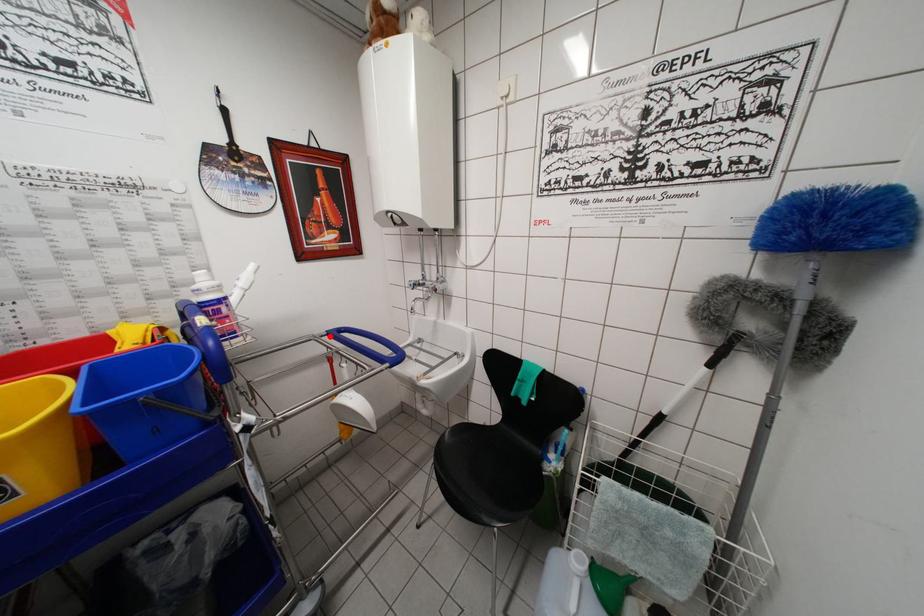
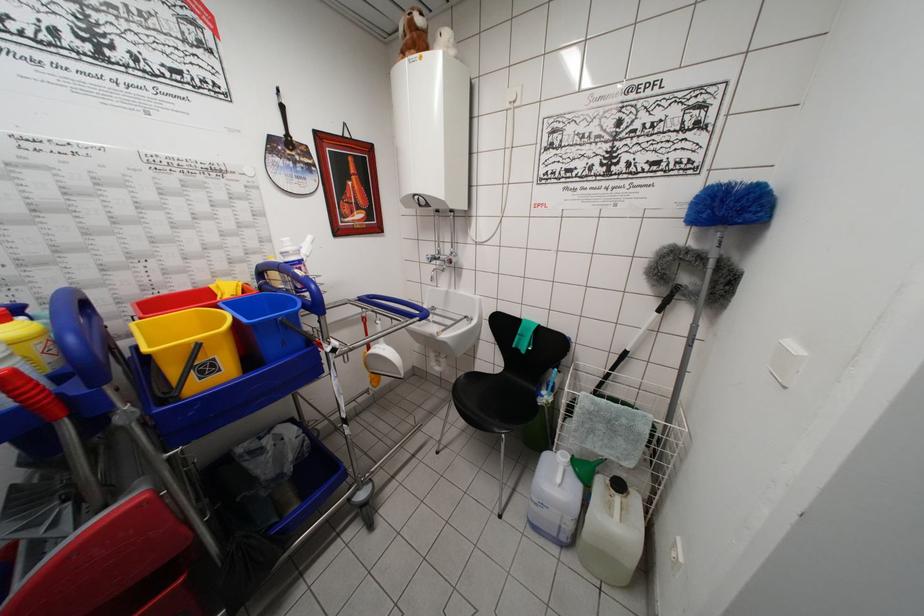
The point at the highlighted location is marked in the first image. Where is the corresponding point in the second image?

(360, 302)